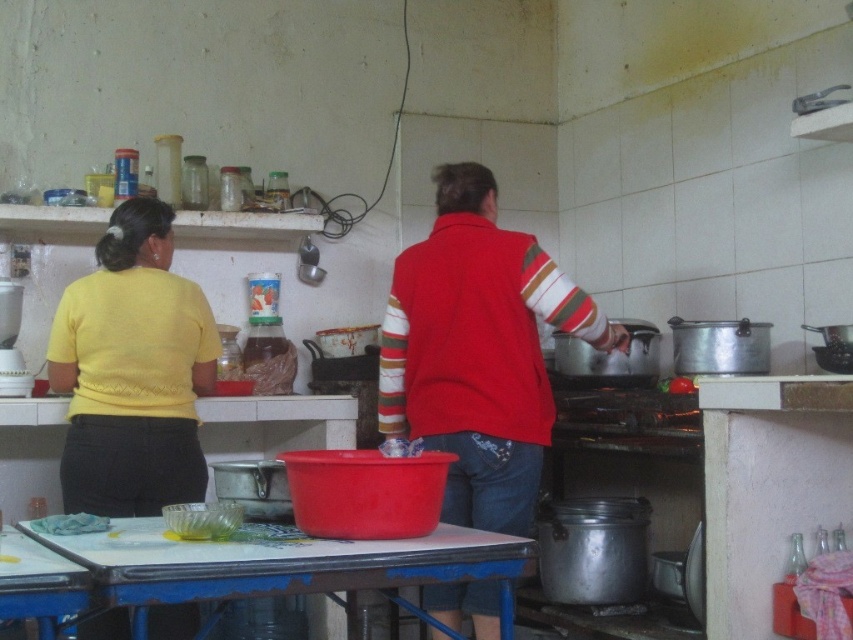
Describe the element at coordinates (479, 352) in the screenshot. I see `red matte sweater at center` at that location.

Does red matte sweater at center appear on the left side of yellow knitwear at left?

No, red matte sweater at center is not to the left of yellow knitwear at left.

This screenshot has width=853, height=640. Identify the location of red matte sweater at center. (479, 352).

Which is behind, point (56, 346) or point (141, 561)?

The point (56, 346) is behind.

Measure the distance from yellow knitwear at left to smooth plastic table at center.

The distance of yellow knitwear at left from smooth plastic table at center is 39.13 inches.

This screenshot has height=640, width=853. Describe the element at coordinates (132, 371) in the screenshot. I see `yellow knitwear at left` at that location.

Where is `yellow knitwear at left`? This screenshot has width=853, height=640. yellow knitwear at left is located at coordinates (132, 371).

Who is higher up, red matte sweater at center or smooth plastic table at center?

red matte sweater at center is higher up.

Find the location of a particular element. This screenshot has height=640, width=853. red matte sweater at center is located at coordinates (479, 352).

Describe the element at coordinates (479, 352) in the screenshot. I see `red matte sweater at center` at that location.

The height and width of the screenshot is (640, 853). I want to click on red matte sweater at center, so click(479, 352).